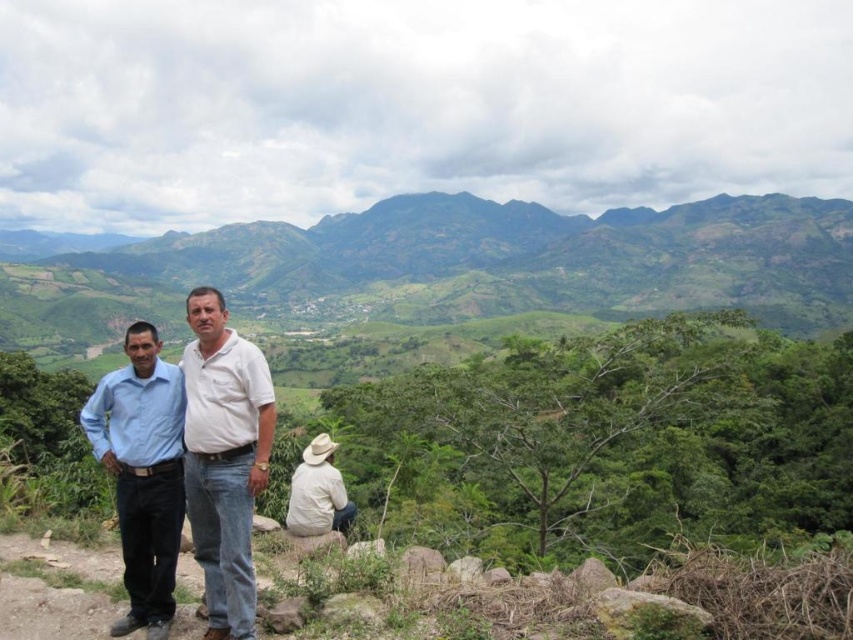
The width and height of the screenshot is (853, 640). What do you see at coordinates (460, 266) in the screenshot? I see `green leafy mountain at upper center` at bounding box center [460, 266].

Is point (248, 237) positioned behind point (328, 474)?

Yes, point (248, 237) is farther from viewer.

At what (x,y) coordinates should I click in order to perform the action: click on green leafy mountain at upper center. Please return your answer as a coordinate pair (x, y). This screenshot has width=853, height=640. Looking at the image, I should click on (460, 266).

The width and height of the screenshot is (853, 640). In order to click on green leafy mountain at upper center in this screenshot , I will do `click(460, 266)`.

The image size is (853, 640). What are the coordinates of `blue cotton shirt at left` in the screenshot? It's located at (142, 474).

Is blue cotton shirt at left in front of khaki fabric hat at lower center?

That is True.

Between point (167, 467) and point (293, 516), which one is positioned in front?

Point (167, 467) is more forward.

Find the location of a particular element. The height and width of the screenshot is (640, 853). blue cotton shirt at left is located at coordinates (142, 474).

In the scene shown: Measure the distance between green leafy mountain at upper center and camera.

327.65 meters

Can you confirm if green leafy mountain at upper center is shorter than blue cotton shirt at left?

In fact, green leafy mountain at upper center may be taller than blue cotton shirt at left.

Is point (763, 227) closer to camera compared to point (164, 586)?

No.

The image size is (853, 640). Find the location of `green leafy mountain at upper center`. green leafy mountain at upper center is located at coordinates (460, 266).